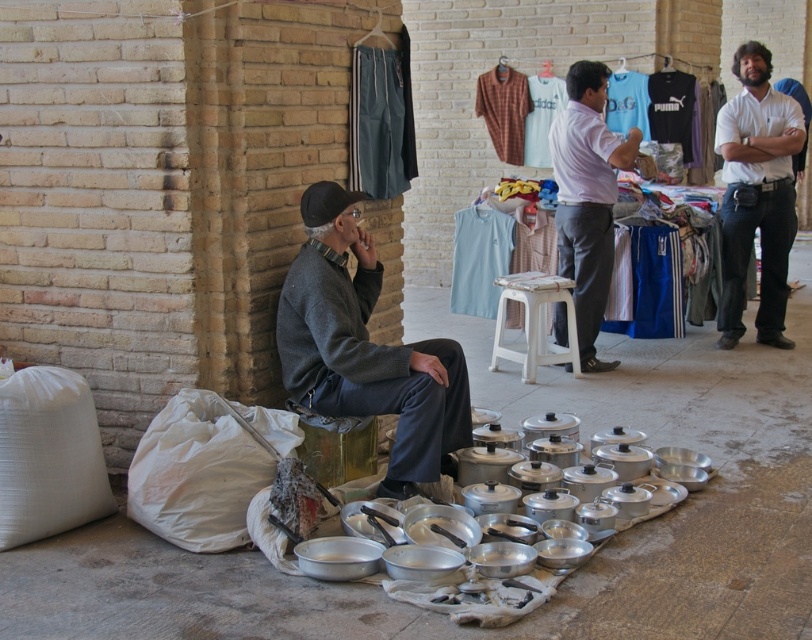
Does light purple shirt at center have a lesser height compared to metallic gold stool at lower center?

Incorrect, light purple shirt at center's height does not fall short of metallic gold stool at lower center's.

Is light purple shirt at center closer to camera compared to metallic gold stool at lower center?

No, light purple shirt at center is behind metallic gold stool at lower center.

Is point (554, 336) closer to camera compared to point (309, 444)?

No, it is not.

Where is `light purple shirt at center`? light purple shirt at center is located at coordinates (586, 198).

Who is shorter, white cotton shirt at upper right or light purple shirt at center?

light purple shirt at center is shorter.

Between point (743, 166) and point (584, 116), which one is positioned in front?

Point (584, 116) is in front.

Locate an element on the screen. white cotton shirt at upper right is located at coordinates (756, 195).

Measure the distance between dark gray sweater at center and camera.

They are 4.19 meters apart.

Can you confirm if dark gray sweater at center is positioned to the right of white plastic stool at center?

Incorrect, dark gray sweater at center is not on the right side of white plastic stool at center.

Measure the distance between point (x=292, y=285) and camera.

Point (x=292, y=285) is 4.40 meters from camera.

The height and width of the screenshot is (640, 812). What are the coordinates of `dark gray sweater at center` in the screenshot? It's located at (365, 348).